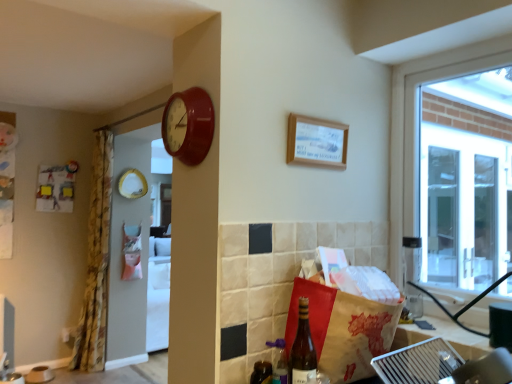
Where is `floral fabric curtain at left`? floral fabric curtain at left is located at coordinates (96, 263).

What do you see at coordinates (96, 263) in the screenshot? I see `floral fabric curtain at left` at bounding box center [96, 263].

In order to face translucent glass bottle at lower right, should I rotate leftwards or rightwards?

Rotate your view right by about 6.380°.

Image resolution: width=512 pixels, height=384 pixels. I want to click on matte red clock at upper center, so click(x=188, y=125).

Find the location of `wooden frame at upper center`. wooden frame at upper center is located at coordinates (316, 141).

Looking at this image, considering the sizes of objects translucent glass bottle at lower right and matte red clock at upper center in the image provided, who is bigger, translucent glass bottle at lower right or matte red clock at upper center?

With larger size is matte red clock at upper center.

Can you see translucent glass bottle at lower right touching matte red clock at upper center?

No, translucent glass bottle at lower right is not beside matte red clock at upper center.

Between translucent glass bottle at lower right and matte red clock at upper center, which one appears on the right side from the viewer's perspective?

From the viewer's perspective, translucent glass bottle at lower right appears more on the right side.

How many degrees apart are the facing directions of translucent glass bottle at lower right and floral fabric curtain at left?

0.231 degrees.

From a real-world perspective, is translucent glass bottle at lower right located beneath floral fabric curtain at left?

Correct, in the physical world, translucent glass bottle at lower right is lower than floral fabric curtain at left.

This screenshot has width=512, height=384. What are the coordinates of `curtain on the left of translucent glass bottle at lower right` in the screenshot? It's located at (96, 263).

Is translucent glass bottle at lower right touching floral fabric curtain at left?

No, translucent glass bottle at lower right is not next to floral fabric curtain at left.

From the image's perspective, is shiny dark brown bottle at lower center, marked as the 1th bottle in a back-to-front arrangement, positioned above or below matte red clock at upper center?

Clearly, from the image's perspective, shiny dark brown bottle at lower center, marked as the 1th bottle in a back-to-front arrangement, is below matte red clock at upper center.

Which of these two, shiny dark brown bottle at lower center, the second bottle viewed from the front, or matte red clock at upper center, is thinner?

shiny dark brown bottle at lower center, the second bottle viewed from the front.

Where is `clock above the shiny dark brown bottle at lower center, the second bottle viewed from the front (from the image's perspective)`? clock above the shiny dark brown bottle at lower center, the second bottle viewed from the front (from the image's perspective) is located at coordinates (188, 125).

How many degrees apart are the facing directions of shiny dark brown bottle at lower center, marked as the 1th bottle in a back-to-front arrangement, and matte red clock at upper center?

There is a 1.22-degree angle between the facing directions of shiny dark brown bottle at lower center, marked as the 1th bottle in a back-to-front arrangement, and matte red clock at upper center.

Can you tell me how much matte red clock at upper center and shiny dark brown bottle at lower center, the second bottle viewed from the front, differ in facing direction?

There is a 1.22-degree angle between the facing directions of matte red clock at upper center and shiny dark brown bottle at lower center, the second bottle viewed from the front.

Considering the relative sizes of matte red clock at upper center and shiny dark brown bottle at lower center, the second bottle viewed from the front, in the image provided, is matte red clock at upper center bigger than shiny dark brown bottle at lower center, the second bottle viewed from the front,?

Correct, matte red clock at upper center is larger in size than shiny dark brown bottle at lower center, the second bottle viewed from the front.

From a real-world perspective, is matte red clock at upper center located higher than shiny dark brown bottle at lower center, the second bottle viewed from the front?

Indeed, from a real-world perspective, matte red clock at upper center stands above shiny dark brown bottle at lower center, the second bottle viewed from the front.

Is shiny dark brown bottle at lower center, marked as the 1th bottle in a back-to-front arrangement, located within matte red clock at upper center?

No, matte red clock at upper center does not contain shiny dark brown bottle at lower center, marked as the 1th bottle in a back-to-front arrangement.

Is brown paper bag at lower right beside floral fabric curtain at left?

No, brown paper bag at lower right is not touching floral fabric curtain at left.

From the image's perspective, is brown paper bag at lower right above or below floral fabric curtain at left?

brown paper bag at lower right is situated higher than floral fabric curtain at left in the image.

Visually, is brown paper bag at lower right positioned to the left or to the right of floral fabric curtain at left?

brown paper bag at lower right is to the right of floral fabric curtain at left.

Is floral fabric curtain at left touching translucent glass bottle at lower center, acting as the first bottle starting from the front?

No, floral fabric curtain at left is not beside translucent glass bottle at lower center, acting as the first bottle starting from the front.

Considering the sizes of floral fabric curtain at left and translucent glass bottle at lower center, the second bottle viewed from the back, in the image, is floral fabric curtain at left taller or shorter than translucent glass bottle at lower center, the second bottle viewed from the back,?

Clearly, floral fabric curtain at left is taller compared to translucent glass bottle at lower center, the second bottle viewed from the back.

Which object is closer to the camera taking this photo, floral fabric curtain at left or translucent glass bottle at lower center, acting as the first bottle starting from the front?

A: translucent glass bottle at lower center, acting as the first bottle starting from the front, is more forward.

Is translucent glass bottle at lower center, acting as the first bottle starting from the front, aimed at wooden frame at upper center?

No, translucent glass bottle at lower center, acting as the first bottle starting from the front, is not aimed at wooden frame at upper center.

From the image's perspective, is translucent glass bottle at lower center, the second bottle viewed from the back, beneath wooden frame at upper center?

Yes, from the image's perspective, translucent glass bottle at lower center, the second bottle viewed from the back, is below wooden frame at upper center.

From a real-world perspective, who is located lower, translucent glass bottle at lower center, the second bottle viewed from the back, or wooden frame at upper center?

translucent glass bottle at lower center, the second bottle viewed from the back, is physically lower.

Where is `the 2nd bottle in front of the wooden frame at upper center, counting from the anchor's position`? The image size is (512, 384). the 2nd bottle in front of the wooden frame at upper center, counting from the anchor's position is located at coordinates (279, 361).

In the image, there is a translucent glass bottle at lower right. Where is `clock above it (from the image's perspective)`? clock above it (from the image's perspective) is located at coordinates (188, 125).

At what (x,y) coordinates should I click in order to perform the action: click on beer bottle on the right of floral fabric curtain at left. Please return your answer as a coordinate pair (x, y). The image size is (512, 384). Looking at the image, I should click on (303, 348).

Estimate the real-world distances between objects in this image. Which object is further from shiny dark brown bottle at lower center, marked as the 1th bottle in a back-to-front arrangement, matte red clock at upper center or brown paper bag at lower right?

The object further to shiny dark brown bottle at lower center, marked as the 1th bottle in a back-to-front arrangement, is matte red clock at upper center.

Estimate the real-world distances between objects in this image. Which object is closer to floral fabric curtain at left, translucent glass bottle at lower right or shiny dark brown bottle at lower center, the second bottle viewed from the front?

shiny dark brown bottle at lower center, the second bottle viewed from the front, lies closer to floral fabric curtain at left than the other object.

Based on their spatial positions, is translucent glass bottle at lower center, acting as the first bottle starting from the front, or floral fabric curtain at left closer to translucent glass bottle at lower right?

The object closer to translucent glass bottle at lower right is translucent glass bottle at lower center, acting as the first bottle starting from the front.

Estimate the real-world distances between objects in this image. Which object is closer to translucent glass bottle at lower center, the second bottle viewed from the back, wooden frame at upper center or shiny dark brown bottle at lower center, marked as the 1th bottle in a back-to-front arrangement?

Among the two, shiny dark brown bottle at lower center, marked as the 1th bottle in a back-to-front arrangement, is located nearer to translucent glass bottle at lower center, the second bottle viewed from the back.

Estimate the real-world distances between objects in this image. Which object is further from floral fabric curtain at left, shiny dark brown bottle at lower center, the second bottle viewed from the front, or translucent glass bottle at lower center, acting as the first bottle starting from the front?

translucent glass bottle at lower center, acting as the first bottle starting from the front, is further to floral fabric curtain at left.

Looking at the image, which one is located closer to shiny dark brown bottle at lower center, marked as the 1th bottle in a back-to-front arrangement, translucent glass bottle at lower right or wooden frame at upper center?

translucent glass bottle at lower right lies closer to shiny dark brown bottle at lower center, marked as the 1th bottle in a back-to-front arrangement, than the other object.

Which object lies further to the anchor point translucent glass bottle at lower center, acting as the first bottle starting from the front, shiny dark brown bottle at lower center, the second bottle viewed from the front, or translucent glass bottle at lower right?

Among the two, translucent glass bottle at lower right is located further to translucent glass bottle at lower center, acting as the first bottle starting from the front.

Estimate the real-world distances between objects in this image. Which object is further from translucent glass bottle at lower center, acting as the first bottle starting from the front, wooden frame at upper center or brown paper bag at lower right?

Based on the image, wooden frame at upper center appears to be further to translucent glass bottle at lower center, acting as the first bottle starting from the front.

Identify the location of shopping bag between wooden frame at upper center and translucent glass bottle at lower center, acting as the first bottle starting from the front, in the vertical direction. (343, 329).

What are the coordinates of `clock between brown paper bag at lower right and floral fabric curtain at left in the front-back direction` in the screenshot? It's located at (188, 125).

Identify the location of bottle located between translucent glass bottle at lower center, acting as the first bottle starting from the front, and floral fabric curtain at left in the depth direction. The width and height of the screenshot is (512, 384). (262, 373).

At what (x,y) coordinates should I click in order to perform the action: click on beer bottle between matte red clock at upper center and shiny dark brown bottle at lower center, the second bottle viewed from the front, in the vertical direction. Please return your answer as a coordinate pair (x, y). Looking at the image, I should click on (303, 348).